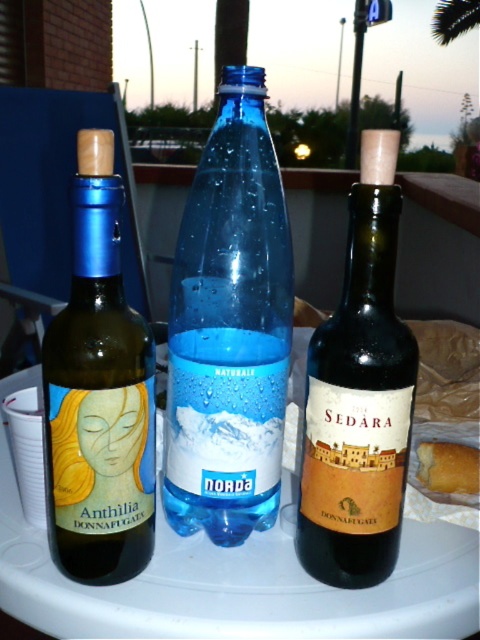
Is transparent plastic bottle at center closer to the viewer compared to matte glass wine at left?

No, transparent plastic bottle at center is behind matte glass wine at left.

Does transparent plastic bottle at center have a larger size compared to matte glass wine at left?

Indeed, transparent plastic bottle at center has a larger size compared to matte glass wine at left.

In order to click on transparent plastic bottle at center in this screenshot , I will do `click(229, 326)`.

Is transparent plastic bottle at center shorter than golden bread at center?

In fact, transparent plastic bottle at center may be taller than golden bread at center.

Can you confirm if transparent plastic bottle at center is thinner than golden bread at center?

No.

Identify the location of transparent plastic bottle at center. The height and width of the screenshot is (640, 480). (x=229, y=326).

Which of these two, dark brown glass wine at center or golden bread at center, stands shorter?

golden bread at center is shorter.

Is dark brown glass wine at center further to camera compared to golden bread at center?

That is False.

What do you see at coordinates (360, 396) in the screenshot? I see `dark brown glass wine at center` at bounding box center [360, 396].

Image resolution: width=480 pixels, height=640 pixels. I want to click on dark brown glass wine at center, so click(x=360, y=396).